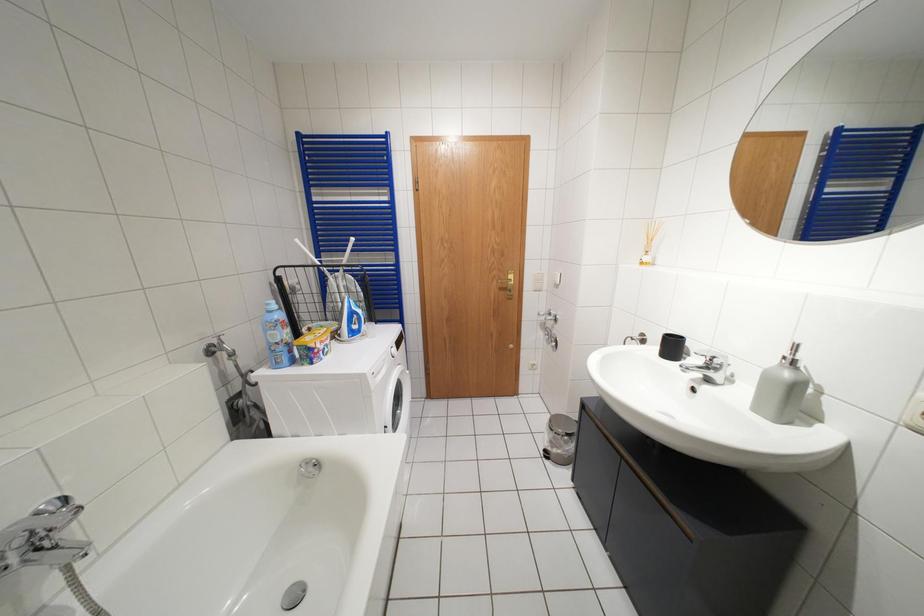
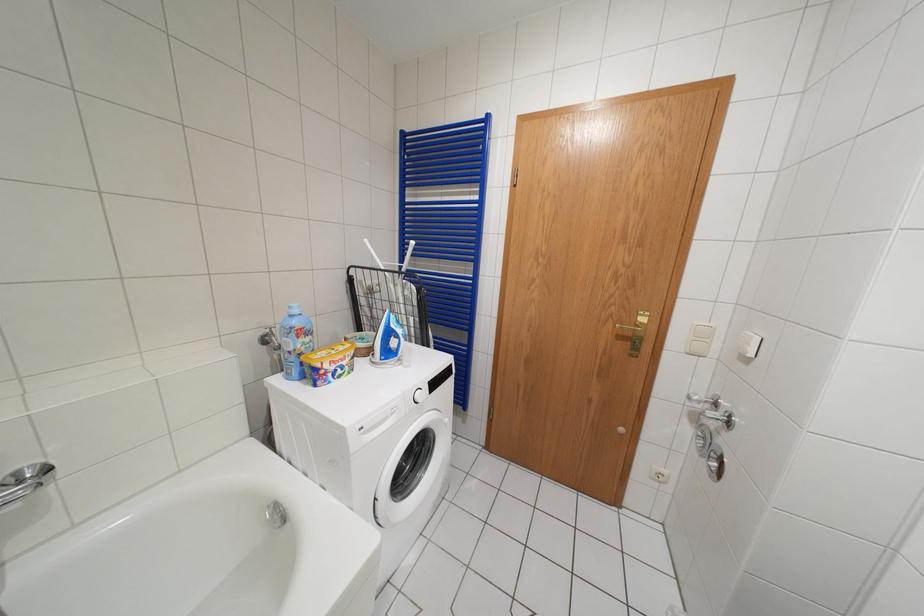
Question: The camera is either moving clockwise (left) or counter-clockwise (right) around the object. The first image is from the beginning of the video and the second image is from the end. Is the camera moving left or right when shooting the video?

Choices:
 (A) Left
 (B) Right

Answer: (B)